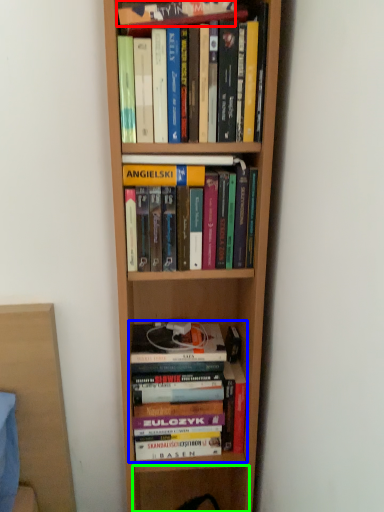
Question: Which object is positioned closest to book (highlighted by a red box)? Select from book (highlighted by a blue box) and shelf (highlighted by a green box).

Choices:
 (A) book
 (B) shelf

Answer: (A)